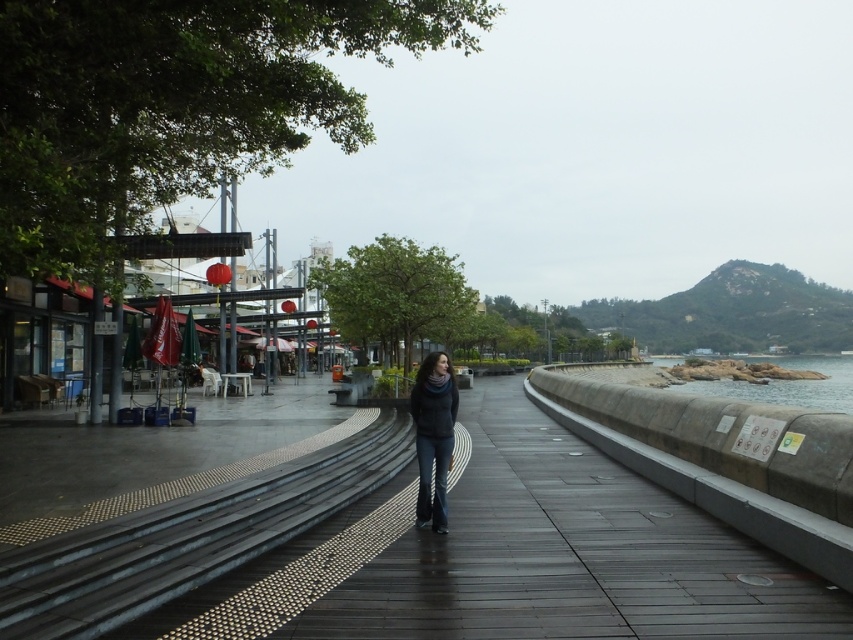
Based on the photo, you are standing at the entrance of the covered seating area with red umbrellas on the left. You want to find the dark gray sweater at center. In which direction should you walk to reach it?

Answer: The dark gray sweater at center is located at point (433,435). Since you are at the entrance of the covered seating area on the left, you should walk to the right to reach the dark gray sweater at center.

You are a photographer trying to capture a photo of the dark gray sweater at center and the rocky shore at right. Which object should you focus on first if you want to include both in the same frame without moving the camera?

The dark gray sweater at center is smaller than the rocky shore at right, so you should focus on the rocky shore at right first to ensure it is in sharp focus since it is larger and more prominent in the frame.

You are standing on the wooden at center and want to reach the smooth concrete steps at lower left. Which direction should you move to get there?

The smooth concrete steps at lower left is behind the wooden at center, so you should move backward to reach them.